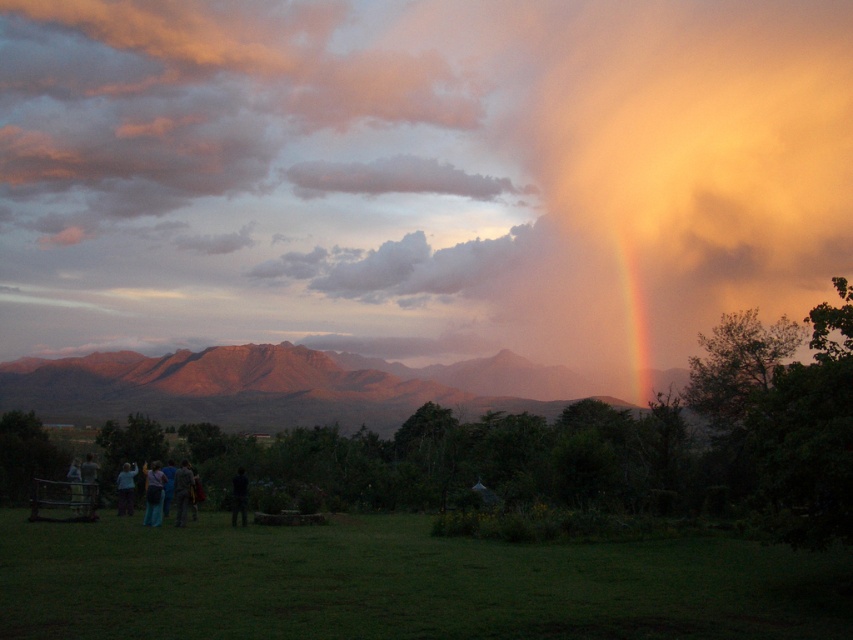
Question: Which point appears closest to the camera in this image?

Choices:
 (A) (242, 483)
 (B) (666, 252)

Answer: (A)

Question: Which point is closer to the camera?

Choices:
 (A) (384, 161)
 (B) (126, 506)
 (C) (96, 403)
 (D) (158, 492)

Answer: (D)

Question: Is camouflage fabric jacket at lower left bigger than light blue fabric at lower left?

Choices:
 (A) no
 (B) yes

Answer: (B)

Question: Is light blue fabric at lower left to the right of dark fabric jacket at lower left from the viewer's perspective?

Choices:
 (A) yes
 (B) no

Answer: (B)

Question: Which of the following is the farthest from the observer?

Choices:
 (A) light blue jeans at lower center
 (B) light blue fabric at lower left
 (C) dark fabric jacket at lower left

Answer: (B)

Question: Is light blue jeans at lower center thinner than light blue fabric at lower left?

Choices:
 (A) yes
 (B) no

Answer: (B)